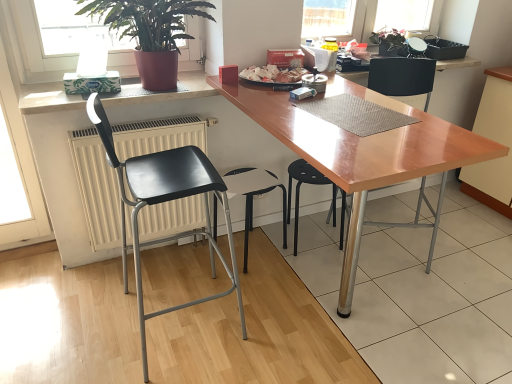
You are a GUI agent. You are given a task and a screenshot of the screen. Output one action in this format:
    pyautogui.click(x=<x>, y=<y>)
    Task: Click on the free location to the right of black plastic stool at center, positioned as the third chair in right-to-left order
    This screenshot has height=384, width=512.
    Given the screenshot: What is the action you would take?
    pyautogui.click(x=310, y=271)